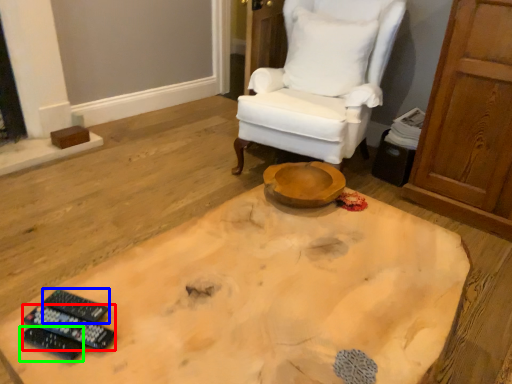
Question: Based on their relative distances, which object is farther from remote control (highlighted by a red box)? Choose from remote control (highlighted by a blue box) and remote control (highlighted by a green box).

Choices:
 (A) remote control
 (B) remote control

Answer: (A)